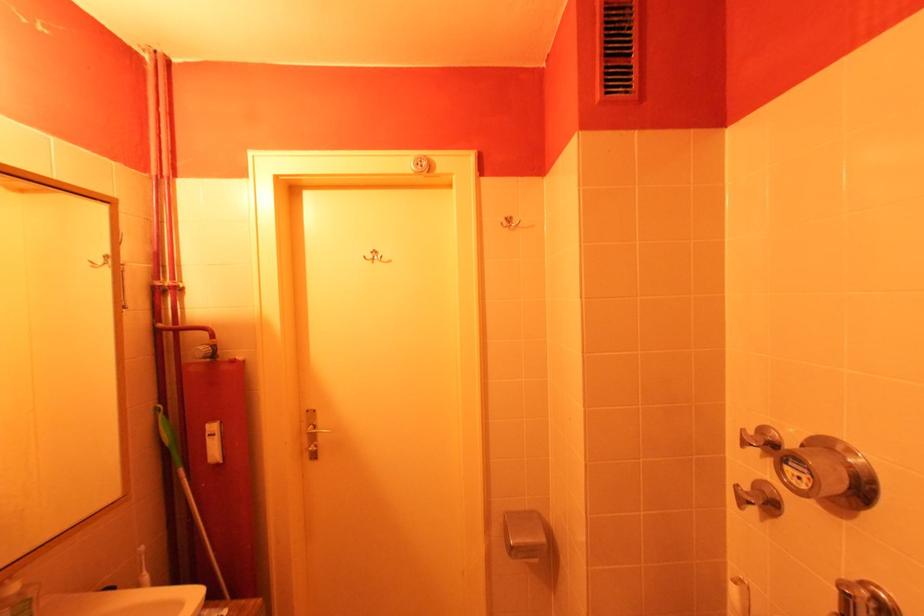
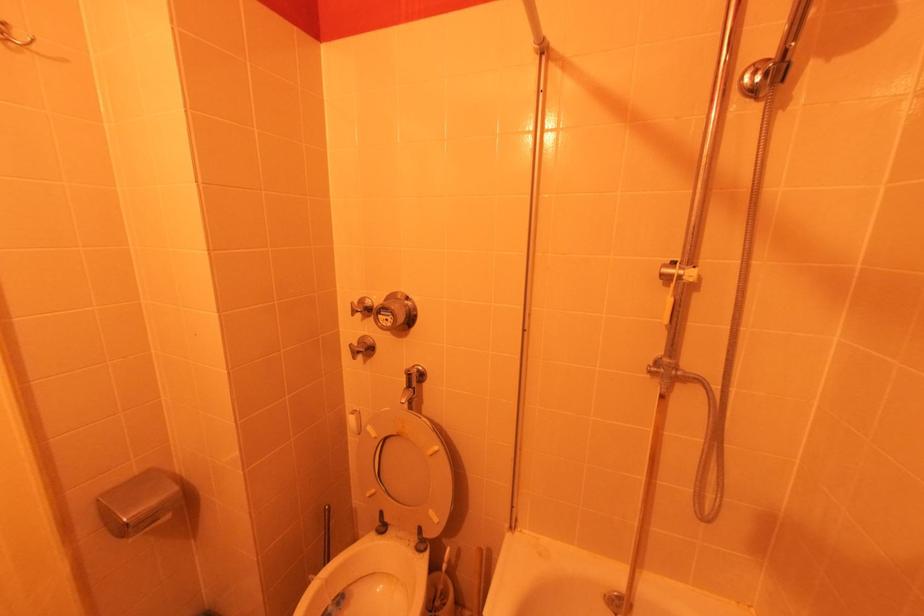
Question: Based on the continuous images, in which direction is the camera rotating? Reply with the corresponding letter.

Choices:
 (A) Left
 (B) Right
 (C) Up
 (D) Down

Answer: (B)